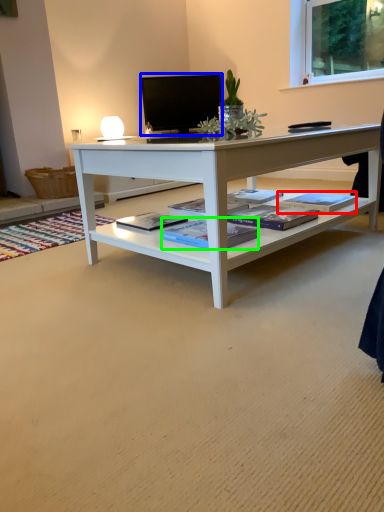
Question: Which is farther away from book (highlighted by a red box)? television (highlighted by a blue box) or book (highlighted by a green box)?

Choices:
 (A) television
 (B) book

Answer: (A)